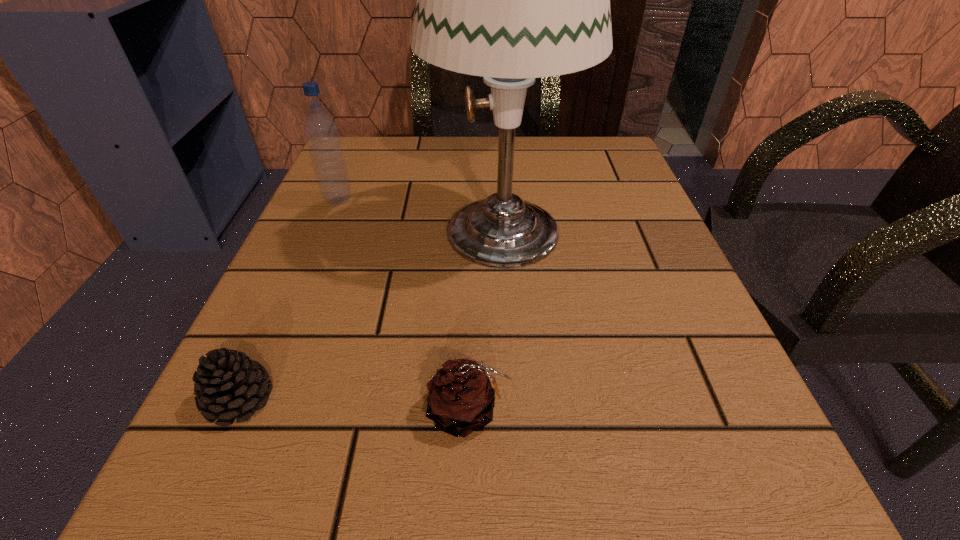
Identify the location of object that is at the far edge. This screenshot has width=960, height=540. (511, 0).

The width and height of the screenshot is (960, 540). I want to click on water bottle situated at the left edge, so click(321, 131).

Where is `pinecone that is positioned at the left edge`? Image resolution: width=960 pixels, height=540 pixels. pinecone that is positioned at the left edge is located at coordinates (228, 385).

Find the location of `object at the right edge`. object at the right edge is located at coordinates (511, 0).

The height and width of the screenshot is (540, 960). In order to click on object that is at the far right corner in this screenshot , I will do `click(511, 0)`.

This screenshot has width=960, height=540. In the image, there is a desktop. In order to click on vacant area at the far edge in this screenshot , I will do `click(406, 192)`.

In the image, there is a desktop. Where is `vacant space at the left edge`? vacant space at the left edge is located at coordinates (354, 372).

In the image, there is a desktop. What are the coordinates of `vacant space at the right edge` in the screenshot? It's located at (635, 218).

Find the location of a particular element. The image size is (960, 540). vacant space at the near left corner of the desktop is located at coordinates (182, 475).

Image resolution: width=960 pixels, height=540 pixels. I want to click on free region at the far right corner of the desktop, so click(592, 135).